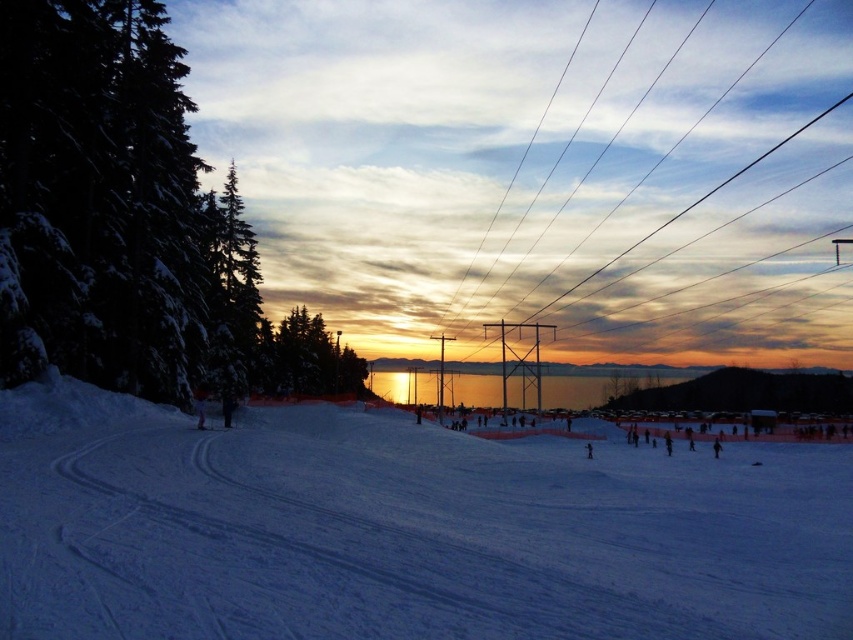
Question: Is white powdery snow at center to the left of snow-covered evergreen trees at left from the viewer's perspective?

Choices:
 (A) no
 (B) yes

Answer: (A)

Question: Considering the real-world distances, which object is farthest from the black wire at center?

Choices:
 (A) white powdery snow at center
 (B) snow-covered evergreen trees at left
 (C) green matte tree at center-left

Answer: (A)

Question: Can you confirm if white powdery snow at center is positioned to the left of black wire at center?

Choices:
 (A) yes
 (B) no

Answer: (A)

Question: Which of the following is the closest to the observer?

Choices:
 (A) green matte tree at center-left
 (B) white powdery snow at center

Answer: (B)

Question: Which point is farther from the camera taking this photo?

Choices:
 (A) (289, 364)
 (B) (93, 292)

Answer: (A)

Question: Is white powdery snow at center closer to camera compared to black wire at center?

Choices:
 (A) no
 (B) yes

Answer: (B)